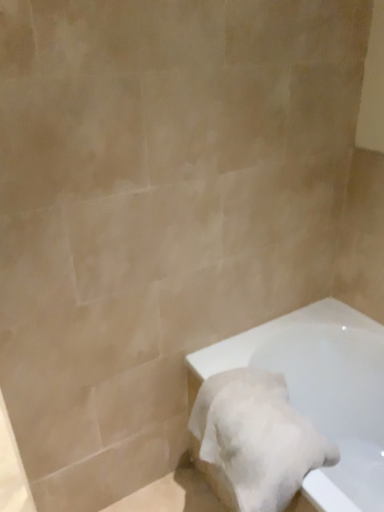
At what (x,y) coordinates should I click in order to perform the action: click on white glossy bathtub at lower right. Please return your answer as a coordinate pair (x, y). The height and width of the screenshot is (512, 384). Looking at the image, I should click on (319, 388).

Describe the element at coordinates (319, 388) in the screenshot. I see `white glossy bathtub at lower right` at that location.

Identify the location of white glossy bathtub at lower right. coord(319,388).